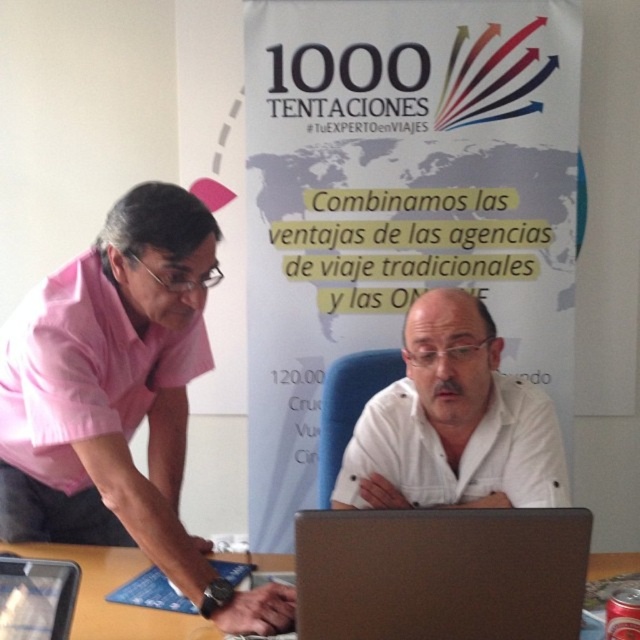
You are standing in front of the banner and want to place a sticker exactly at the point marked as point (400, 202). Where should you place the sticker relative to the banner?

The point (400, 202) is on white paperboard at upper center, so you should place the sticker on the white paperboard at upper center of the banner.

You are a photographer standing in front of the scene. You want to capture a photo that includes both the white paperboard at upper center and the white matte shirt at center. Which object should you focus on first to ensure both are in frame?

The white paperboard at upper center is taller than the white matte shirt at center, so you should focus on the white paperboard at upper center first to ensure both fit within the frame.